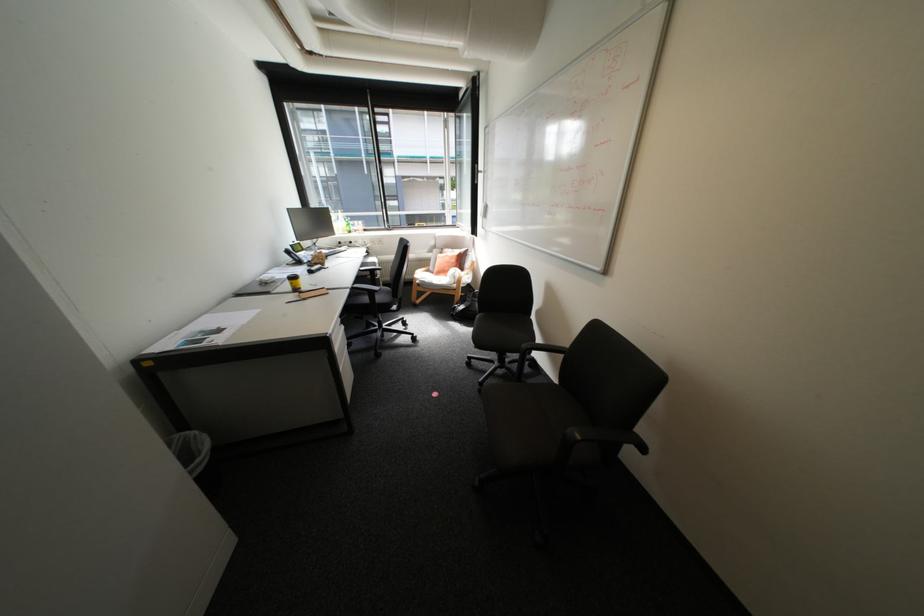
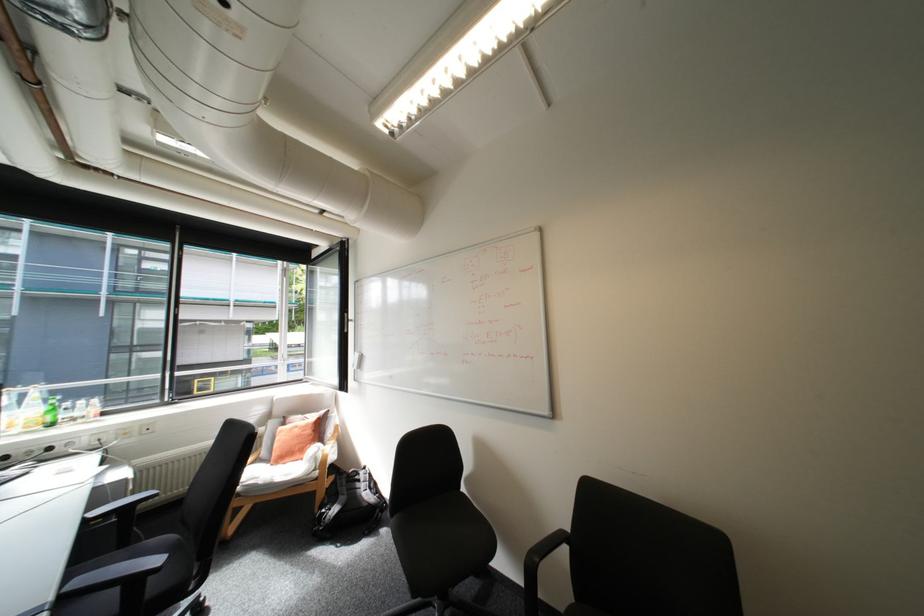
First-person continuous shooting, in which direction is the camera rotating?

The camera rotated toward right-up.